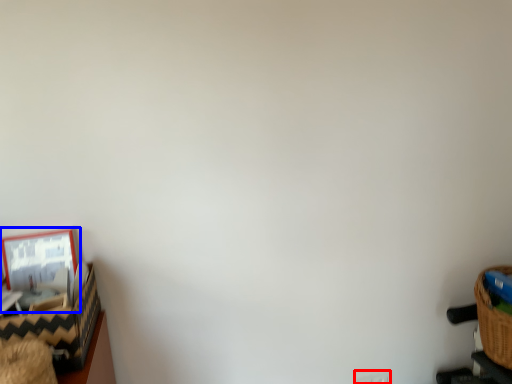
Question: Among these objects, which one is farthest to the camera, electric outlet (highlighted by a red box) or picture frame (highlighted by a blue box)?

Choices:
 (A) electric outlet
 (B) picture frame

Answer: (A)